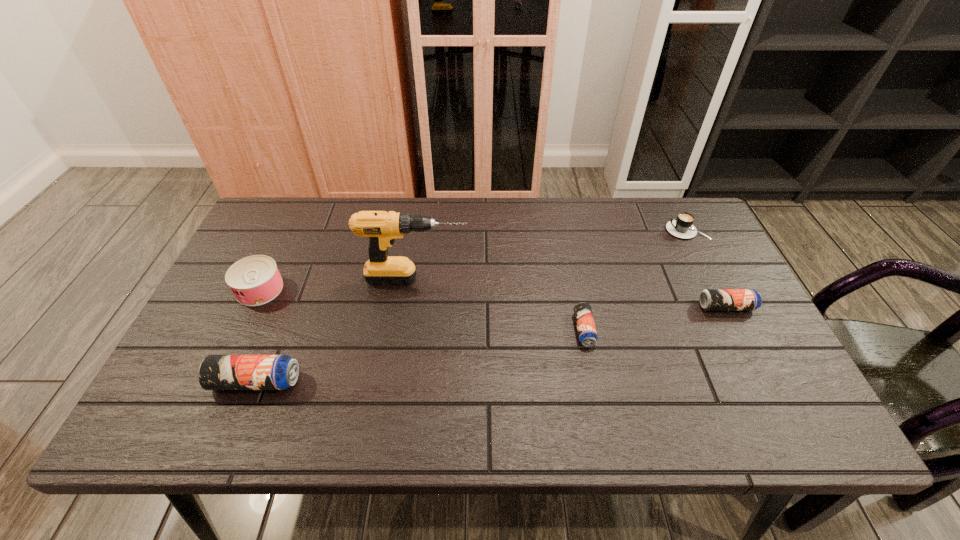
This screenshot has height=540, width=960. Find the location of `can that is at the left edge`. can that is at the left edge is located at coordinates (255, 280).

Where is `beer can that is at the right edge`? The height and width of the screenshot is (540, 960). beer can that is at the right edge is located at coordinates (710, 299).

Locate an element on the screen. This screenshot has height=540, width=960. cappuccino present at the right edge is located at coordinates click(682, 226).

The image size is (960, 540). What are the coordinates of `object present at the near left corner` in the screenshot? It's located at (216, 372).

Locate an element on the screen. object located at the far right corner is located at coordinates (682, 226).

In the image, there is a desktop. At what (x,y) coordinates should I click in order to perform the action: click on vacant space at the far edge. Please return your answer as a coordinate pair (x, y). Looking at the image, I should click on (568, 246).

Locate an element on the screen. This screenshot has height=540, width=960. vacant region at the near edge is located at coordinates (347, 396).

Find the location of a particular element. This screenshot has width=960, height=540. vacant region at the left edge of the desktop is located at coordinates (202, 330).

In the image, there is a desktop. Where is `vacant space at the right edge`? The image size is (960, 540). vacant space at the right edge is located at coordinates (764, 359).

In order to click on free space at the far left corner of the desktop in this screenshot , I will do `click(274, 229)`.